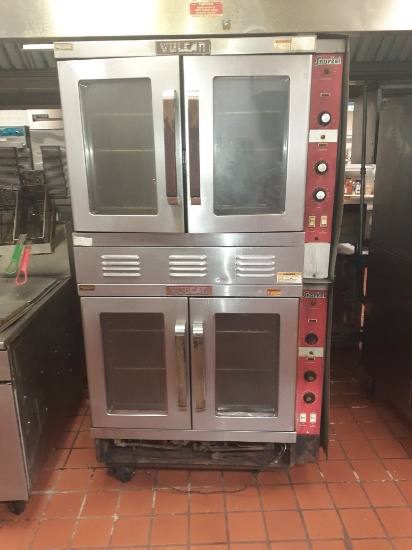
In order to click on top oven in this screenshot , I will do `click(186, 145)`.